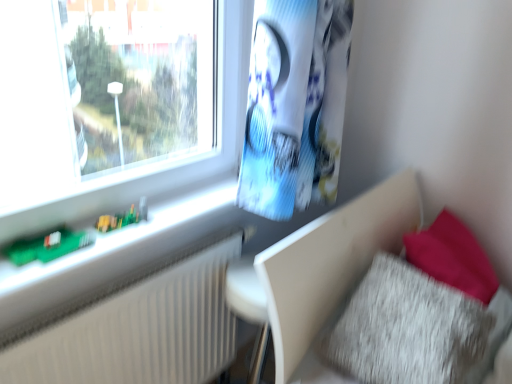
Question: Based on their positions, is white textured radiator at left located to the left or right of fuzzy fabric pillow at lower right?

Choices:
 (A) left
 (B) right

Answer: (A)

Question: Is white textured radiator at left inside or outside of fuzzy fabric pillow at lower right?

Choices:
 (A) outside
 (B) inside

Answer: (A)

Question: Which of these objects is positioned farthest from the white textured radiator at left?

Choices:
 (A) fuzzy fabric pillow at lower right
 (B) green circuit board at left
 (C) green plastic toy at lower left

Answer: (A)

Question: Which object is the closest to the fuzzy fabric pillow at lower right?

Choices:
 (A) white textured radiator at left
 (B) green circuit board at left
 (C) green plastic toy at lower left

Answer: (A)